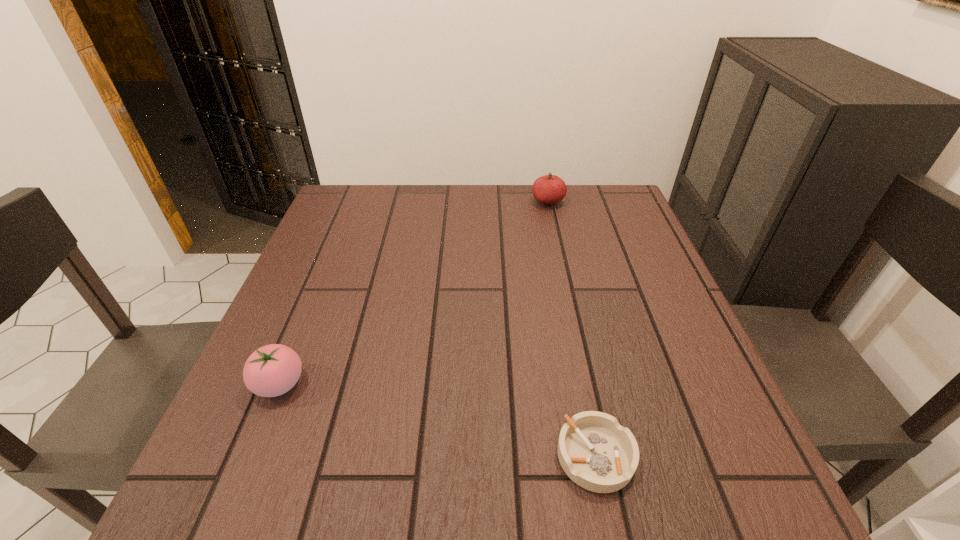
Find the location of a particular element. Image resolution: width=960 pixels, height=540 pixels. object present at the near edge is located at coordinates (598, 454).

At what (x,y) coordinates should I click in order to perform the action: click on object that is positioned at the left edge. Please return your answer as a coordinate pair (x, y). Image resolution: width=960 pixels, height=540 pixels. Looking at the image, I should click on (272, 370).

Find the location of a particular element. vacant space at the far edge of the desktop is located at coordinates coord(460,198).

In the image, there is a desktop. What are the coordinates of `vacant space at the near edge` in the screenshot? It's located at (338, 488).

This screenshot has width=960, height=540. I want to click on free space at the left edge, so pyautogui.click(x=269, y=428).

Identify the location of vacant space at the right edge. The height and width of the screenshot is (540, 960). (722, 387).

In the image, there is a desktop. Where is `free space at the far left corner`? This screenshot has width=960, height=540. free space at the far left corner is located at coordinates (372, 212).

What are the coordinates of `free spot at the far right corner of the desktop` in the screenshot? It's located at (596, 210).

In the image, there is a desktop. Where is `vacant region at the near right corner`? This screenshot has height=540, width=960. vacant region at the near right corner is located at coordinates (752, 472).

You are a GUI agent. You are given a task and a screenshot of the screen. Output one action in this format:
    pyautogui.click(x=<x>, y=<y>)
    Task: Click on the free spot between the farther tomato and the leftmost object
    
    Given the screenshot: What is the action you would take?
    pyautogui.click(x=414, y=293)